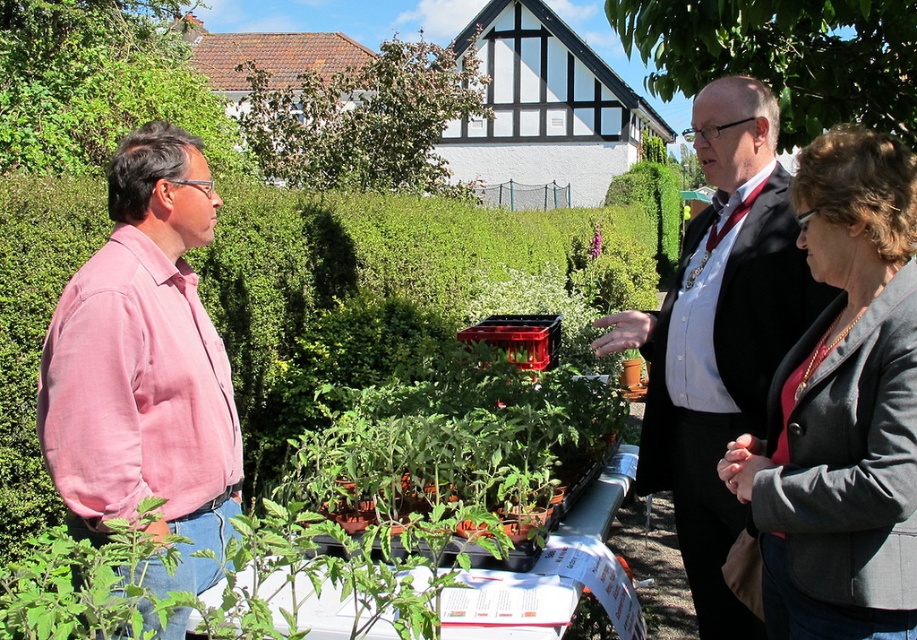
Which is above, gray wool blazer at center or pink cotton shirt at left?

pink cotton shirt at left is higher up.

Looking at this image, who is lower down, gray wool blazer at center or pink cotton shirt at left?

gray wool blazer at center is below.

Between point (808, 515) and point (65, 476), which one is positioned behind?

The point (65, 476) is behind.

This screenshot has height=640, width=917. I want to click on gray wool blazer at center, so click(843, 406).

Who is lower down, gray wool blazer at center or black suit at center?

gray wool blazer at center is below.

Consider the image. Is gray wool blazer at center in front of black suit at center?

Yes, it is.

Between point (804, 518) and point (750, 200), which one is positioned in front?

Point (804, 518) is more forward.

Locate an element on the screen. gray wool blazer at center is located at coordinates (843, 406).

What do you see at coordinates (144, 368) in the screenshot? The height and width of the screenshot is (640, 917). I see `pink cotton shirt at left` at bounding box center [144, 368].

Does pink cotton shirt at left lie in front of black suit at center?

Yes, it is.

Is point (112, 276) farther from camera compared to point (750, 205)?

No.

Identify the location of pink cotton shirt at left. (144, 368).